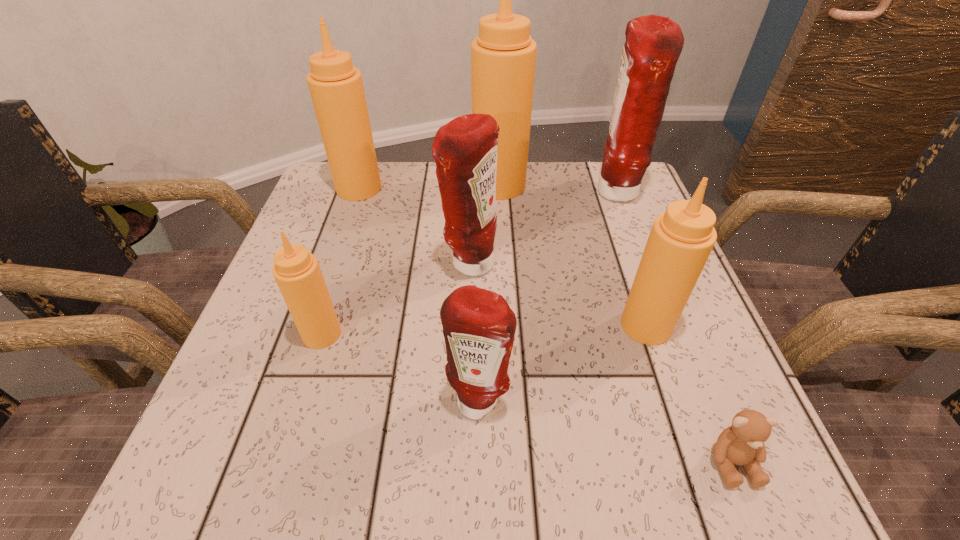
Image resolution: width=960 pixels, height=540 pixels. Find the location of `condiment that is the third closest to the second biggest tan condiment`. condiment that is the third closest to the second biggest tan condiment is located at coordinates (297, 272).

Where is `the fourth closest condiment to the nearest red condiment`? The image size is (960, 540). the fourth closest condiment to the nearest red condiment is located at coordinates (503, 56).

Point out which tan condiment is positioned as the fourth nearest to the nearest object. Please provide its 2D coordinates. Your answer should be formatted as a tuple, i.e. [(x, y)], where the tuple contains the x and y coordinates of a point satisfying the conditions above.

[(336, 87)]

At what (x,y) coordinates should I click in order to perform the action: click on the closest tan condiment to the second smallest tan condiment. Please return your answer as a coordinate pair (x, y). The image size is (960, 540). Looking at the image, I should click on (503, 56).

What are the coordinates of `the second closest red condiment relative to the nearest condiment` in the screenshot? It's located at (653, 45).

Point out which red condiment is positioned as the third nearest to the nearest object. Please provide its 2D coordinates. Your answer should be formatted as a tuple, i.e. [(x, y)], where the tuple contains the x and y coordinates of a point satisfying the conditions above.

[(653, 45)]

Find the location of a particular element. The image size is (960, 540). free space that satisfies the following two spatial constraints: 1. on the back side of the second smallest tan condiment; 2. on the right side of the smallest red condiment is located at coordinates (479, 326).

What are the coordinates of `vacant space that satisfies the following two spatial constraints: 1. on the front side of the biggest red condiment; 2. on the left side of the second biggest tan condiment` in the screenshot? It's located at (358, 192).